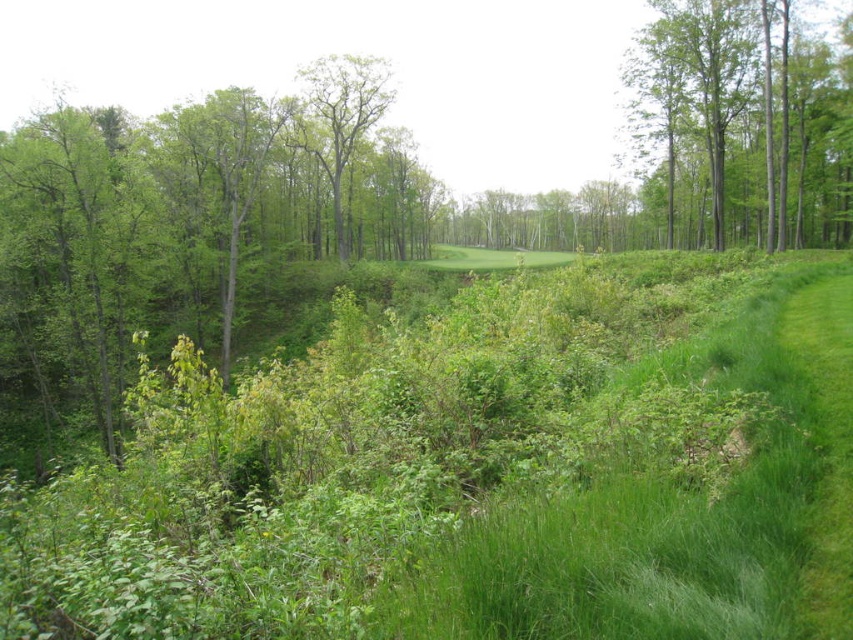
Does point (786, 268) come behind point (668, 234)?

No, it is not.

This screenshot has width=853, height=640. Identify the location of green grass at center. (456, 474).

Which is behind, point (828, 198) or point (321, 156)?

The point (321, 156) is behind.

How much distance is there between green smooth tree at upper right and green leafy tree at center?

The distance of green smooth tree at upper right from green leafy tree at center is 25.75 meters.

Does point (775, 129) come closer to viewer compared to point (344, 81)?

Yes, point (775, 129) is closer to viewer.

Locate an element on the screen. green smooth tree at upper right is located at coordinates (743, 115).

Can you confirm if green grass at center is thinner than green leafy tree at center?

Incorrect, green grass at center's width is not less than green leafy tree at center's.

Is green grass at center positioned behind green leafy tree at center?

No, it is in front of green leafy tree at center.

Is point (648, 621) positioned in front of point (312, 156)?

That is True.

This screenshot has width=853, height=640. In order to click on green grass at center in this screenshot , I will do `click(456, 474)`.